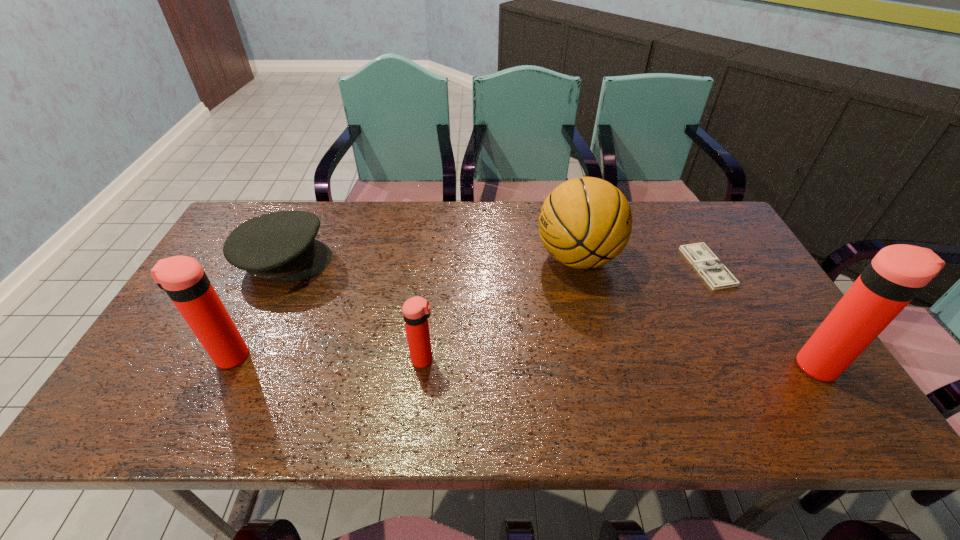
You are a GUI agent. You are given a task and a screenshot of the screen. Output one action in this format:
    pyautogui.click(x=<x>, y=<y>)
    Task: Click on the blank region between the basketball and the second shortest object
    This screenshot has width=960, height=540.
    Given the screenshot: What is the action you would take?
    pyautogui.click(x=431, y=259)

The image size is (960, 540). I want to click on empty space that is in between the leftmost thermos bottle and the rightmost object, so (x=525, y=361).

Locate an element on the screen. The height and width of the screenshot is (540, 960). vacant space in between the second thermos bottle from right to left and the rightmost thermos bottle is located at coordinates (622, 363).

Where is `free space between the rightmost object and the second shortest object`? The image size is (960, 540). free space between the rightmost object and the second shortest object is located at coordinates (552, 313).

Where is `object that stands as the fifth closest to the third object from left to right`? The height and width of the screenshot is (540, 960). object that stands as the fifth closest to the third object from left to right is located at coordinates (895, 276).

Where is `object that is the fourth closest to the shortest thermos bottle`? object that is the fourth closest to the shortest thermos bottle is located at coordinates (713, 271).

The width and height of the screenshot is (960, 540). Identify the location of thermos bottle that is the second closest to the third shortest object. (895, 276).

At what (x,y) coordinates should I click in order to perform the action: click on thermos bottle identified as the closest to the second shortest object. Please return your answer as a coordinate pair (x, y). This screenshot has height=540, width=960. Looking at the image, I should click on (182, 277).

Where is `vacant space that satisfies the following two spatial constraints: 1. on the front-facing side of the fifth tallest object; 2. on the back side of the fifth object from left to right`? The height and width of the screenshot is (540, 960). vacant space that satisfies the following two spatial constraints: 1. on the front-facing side of the fifth tallest object; 2. on the back side of the fifth object from left to right is located at coordinates (281, 267).

You are a GUI agent. You are given a task and a screenshot of the screen. Output one action in this format:
    pyautogui.click(x=<x>, y=<y>)
    Task: Click on the free space that satisfies the following two spatial constraints: 1. on the front-facing side of the fifth tallest object; 2. on the right side of the shortest object
    The width and height of the screenshot is (960, 540).
    Given the screenshot: What is the action you would take?
    pyautogui.click(x=281, y=267)